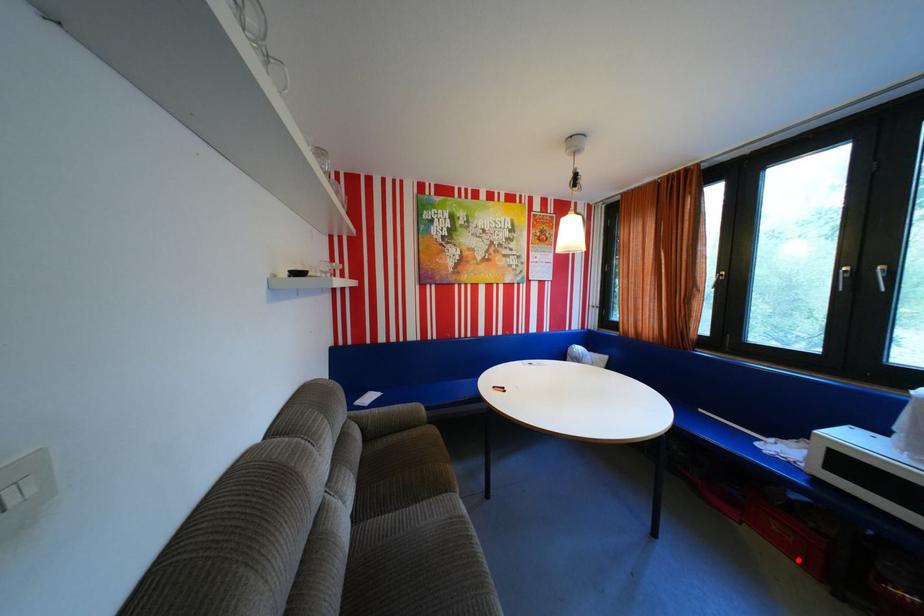
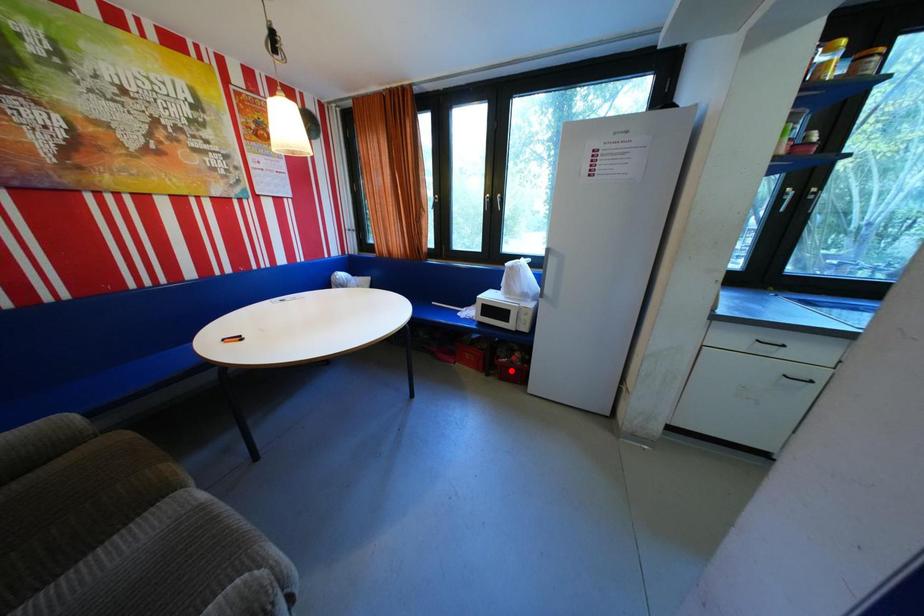
I am providing you with two images of the same scene from different viewpoints. A red point is marked on the first image and another point is marked on the second image. Is the marked point in image1 the same physical position as the marked point in image2?

No